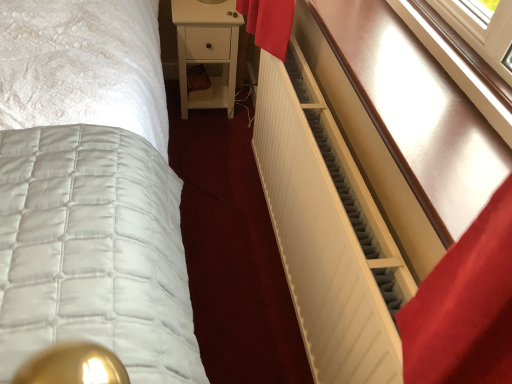
I want to click on white matte nightstand at center, so click(208, 49).

Measure the distance between white matte radiator at right and camera.

They are 25.94 inches apart.

Measure the distance between point (444, 91) and camera.

Point (444, 91) is 34.80 inches from camera.

What do you see at coordinates (90, 190) in the screenshot?
I see `white quilted bed at center` at bounding box center [90, 190].

The height and width of the screenshot is (384, 512). In order to click on white matte nightstand at center in this screenshot , I will do tap(208, 49).

Who is taller, matte white radiator at right or white matte radiator at right?

white matte radiator at right.

Who is bigger, matte white radiator at right or white matte radiator at right?

Bigger between the two is white matte radiator at right.

Does matte white radiator at right lie behind white matte radiator at right?

That is False.

Are matte white radiator at right and white matte radiator at right beside each other?

No, matte white radiator at right is not with white matte radiator at right.

Does point (4, 188) lie in front of point (374, 15)?

That is True.

Can you confirm if white quilted bed at center is smaller than matte white radiator at right?

No.

Does white quilted bed at center appear on the right side of matte white radiator at right?

Incorrect, white quilted bed at center is not on the right side of matte white radiator at right.

From a real-world perspective, is white quilted bed at center positioned over matte white radiator at right based on gravity?

Incorrect, from a real-world perspective, white quilted bed at center is lower than matte white radiator at right.

Which of these two, white matte nightstand at center or white quilted bed at center, is thinner?

white matte nightstand at center is thinner.

Is white matte nightstand at center facing away from white quilted bed at center?

white matte nightstand at center is not turned away from white quilted bed at center.

Is white matte nightstand at center in contact with white quilted bed at center?

No.

Can white quilted bed at center be found inside white matte nightstand at center?

Definitely not — white quilted bed at center is not inside white matte nightstand at center.

Can you confirm if white matte radiator at right is taller than white quilted bed at center?

Indeed, white matte radiator at right has a greater height compared to white quilted bed at center.

Find the location of a particular element. Image resolution: width=512 pixels, height=384 pixels. radiator that appears in front of the white quilted bed at center is located at coordinates (327, 230).

Is white matte radiator at right aimed at white quilted bed at center?

Yes, white matte radiator at right is oriented towards white quilted bed at center.

Does white matte nightstand at center appear on the left side of white matte radiator at right?

Yes.

Considering the relative sizes of white matte nightstand at center and white matte radiator at right in the image provided, is white matte nightstand at center thinner than white matte radiator at right?

No, white matte nightstand at center is not thinner than white matte radiator at right.

Is there a large distance between white matte nightstand at center and white matte radiator at right?

They are positioned close to each other.

From the image's perspective, does white matte nightstand at center appear lower than white matte radiator at right?

Actually, white matte nightstand at center appears above white matte radiator at right in the image.

What's the angular difference between white matte nightstand at center and matte white radiator at right's facing directions?

white matte nightstand at center and matte white radiator at right are facing 90 degrees away from each other.

Would you consider white matte nightstand at center to be distant from matte white radiator at right?

Yes, white matte nightstand at center and matte white radiator at right are quite far apart.

Is white matte nightstand at center behind matte white radiator at right?

Yes.

Does white matte radiator at right lie behind white matte nightstand at center?

No, white matte radiator at right is closer to the camera.

From the image's perspective, is white matte radiator at right above or below white matte nightstand at center?

Based on their image positions, white matte radiator at right is located beneath white matte nightstand at center.

Can you see white matte radiator at right touching white matte nightstand at center?

No.

Measure the distance between white matte radiator at right and white matte nightstand at center.

They are 38.18 inches apart.

Locate an element on the screen. radiator located on the left of matte white radiator at right is located at coordinates (327, 230).

Locate an element on the screen. The image size is (512, 384). bed below the matte white radiator at right (from a real-world perspective) is located at coordinates (90, 190).

Which object lies further to the anchor point white quilted bed at center, matte white radiator at right or white matte radiator at right?

matte white radiator at right.

When comparing their distances from white quilted bed at center, does matte white radiator at right or white matte nightstand at center seem further?

Among the two, white matte nightstand at center is located further to white quilted bed at center.

When comparing their distances from matte white radiator at right, does white quilted bed at center or white matte radiator at right seem further?

white quilted bed at center.

When comparing their distances from white matte radiator at right, does white quilted bed at center or matte white radiator at right seem further?

Based on the image, white quilted bed at center appears to be further to white matte radiator at right.

Looking at the image, which one is located further to matte white radiator at right, white quilted bed at center or white matte nightstand at center?

white matte nightstand at center is positioned further to the anchor matte white radiator at right.

Estimate the real-world distances between objects in this image. Which object is closer to white matte radiator at right, matte white radiator at right or white matte nightstand at center?

Among the two, matte white radiator at right is located nearer to white matte radiator at right.

Based on their spatial positions, is white matte radiator at right or white quilted bed at center further from matte white radiator at right?

Based on the image, white quilted bed at center appears to be further to matte white radiator at right.

When comparing their distances from matte white radiator at right, does white matte nightstand at center or white quilted bed at center seem further?

white matte nightstand at center is positioned further to the anchor matte white radiator at right.

Locate an element on the screen. This screenshot has width=512, height=384. radiator between white quilted bed at center and matte white radiator at right from left to right is located at coordinates click(327, 230).

What are the coordinates of `bed between white matte radiator at right and white matte nightstand at center from front to back` in the screenshot? It's located at (90, 190).

What are the coordinates of `bed positioned between matte white radiator at right and white matte nightstand at center from near to far` in the screenshot? It's located at (90, 190).

Where is `radiator positioned between matte white radiator at right and white matte nightstand at center from near to far`? radiator positioned between matte white radiator at right and white matte nightstand at center from near to far is located at coordinates (327, 230).